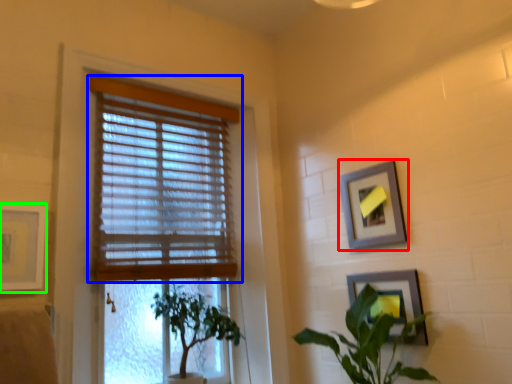
Question: Which is farther away from picture frame (highlighted by a red box)? window blind (highlighted by a blue box) or picture frame (highlighted by a green box)?

Choices:
 (A) window blind
 (B) picture frame

Answer: (B)